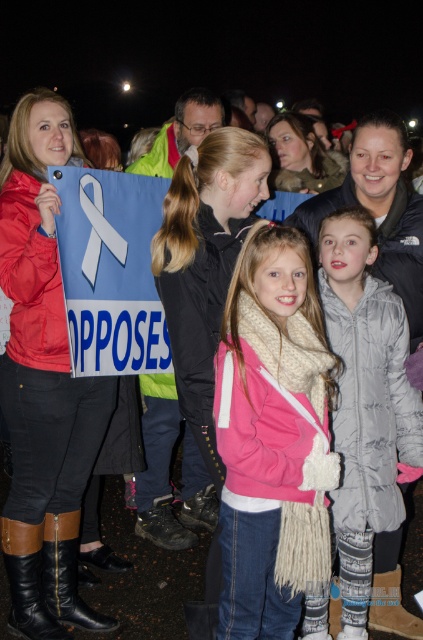
Question: Does brown leather boot at lower left have a larger size compared to black leather boot at lower left?

Choices:
 (A) yes
 (B) no

Answer: (A)

Question: Based on their relative distances, which object is nearer to the brown leather boot at lower left?

Choices:
 (A) black leather boot at lower left
 (B) white quilted jacket at center
 (C) brown suede boot at lower center
 (D) pink fleece jacket at center

Answer: (A)

Question: Which of the following is the farthest from the observer?

Choices:
 (A) (387, 596)
 (B) (282, 284)
 (C) (76, 595)
 (D) (35, 608)

Answer: (A)

Question: Which of the following is the farthest from the observer?

Choices:
 (A) (69, 547)
 (B) (368, 416)
 (C) (43, 634)
 (D) (406, 634)

Answer: (A)

Question: Is the position of brown leather boot at lower left less distant than that of black leather boot at lower left?

Choices:
 (A) yes
 (B) no

Answer: (A)

Question: Is the position of white quilted jacket at center more distant than that of black leather boot at lower left?

Choices:
 (A) no
 (B) yes

Answer: (A)